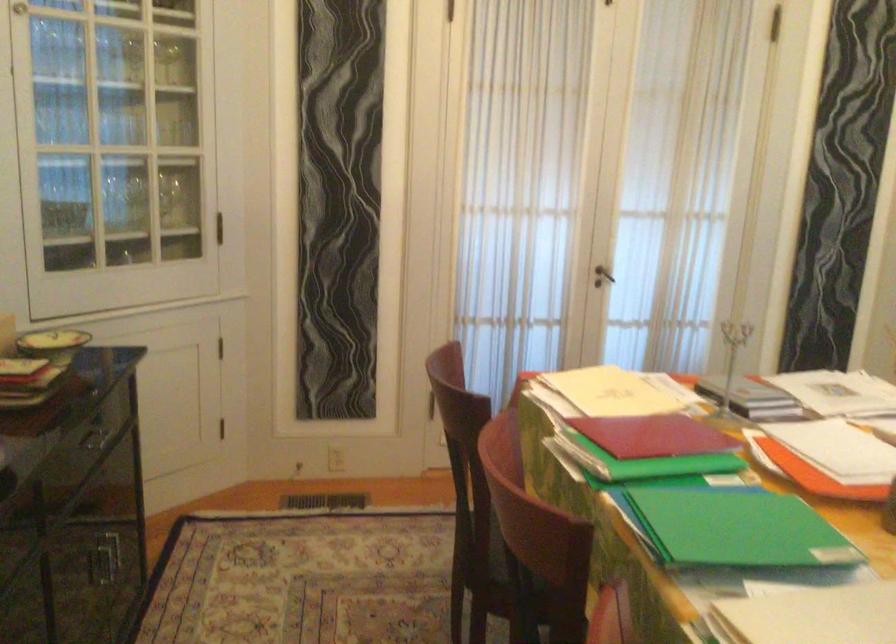
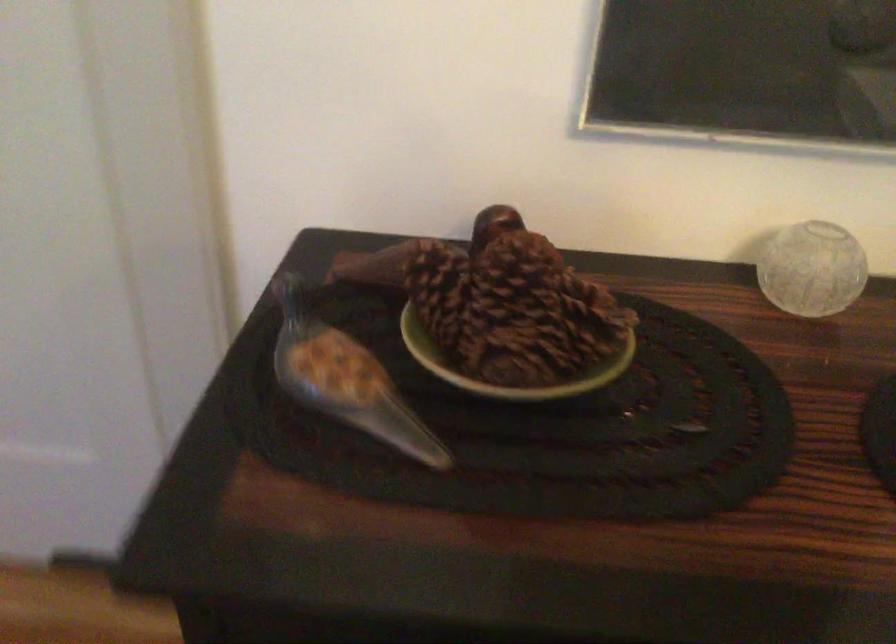
How did the camera likely rotate?

The rotation direction of the camera is left-down.